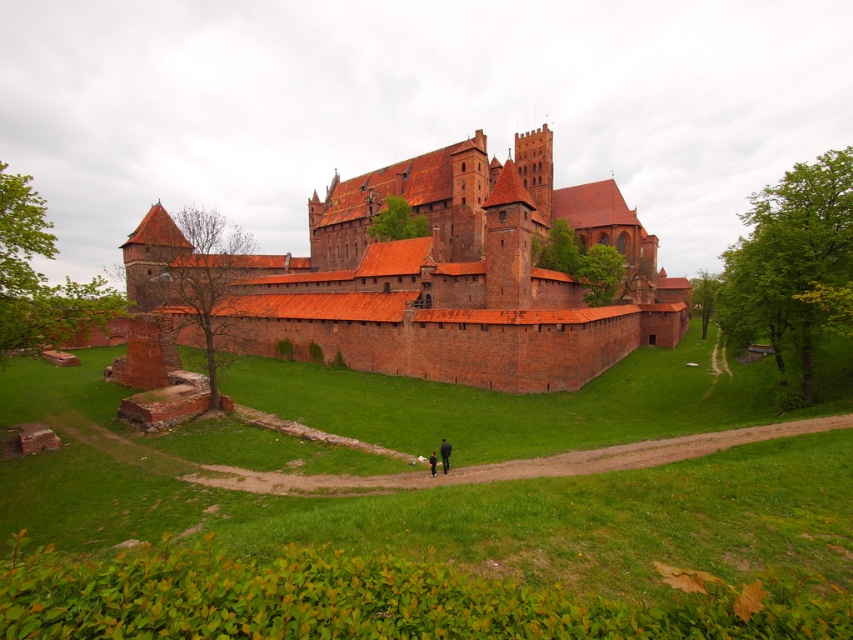
You are a visitor standing on the dirt path leading to the castle. You notice the brick wall at center and the dark blue jeans at lower center. Which object appears bigger in the image?

The brick wall at center is larger in size than dark blue jeans at lower center, so the brick wall at center appears bigger in the image.

You are standing on the dirt path leading to the castle and want to reach the brick wall at center. Which direction should you move relative to the dark blue jeans at lower center?

You should move away from the dark blue jeans at lower center because the brick wall at center is further away from you than the dark blue jeans at lower center.

You are standing at the point marked as point (444, 454) in the image. What object is located at that point?

The point (444, 454) corresponds to dark blue jeans at lower center.